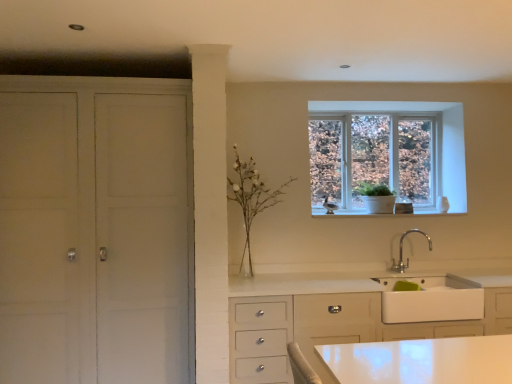
The image size is (512, 384). What do you see at coordinates (95, 230) in the screenshot? I see `white matte cabinet at left` at bounding box center [95, 230].

Looking at this image, what is the approximate height of chrome metallic faucet at lower right?

chrome metallic faucet at lower right is 13.73 inches in height.

The width and height of the screenshot is (512, 384). I want to click on white glass vase at center, so click(x=251, y=197).

Does white matte cabinet at left appear on the right side of clear glass window at upper center?

No.

Is point (96, 179) more distant than point (413, 199)?

No.

From a real-world perspective, is white matte cabinet at left below clear glass window at upper center?

Yes, from a real-world perspective, white matte cabinet at left is beneath clear glass window at upper center.

Looking at this image, is white matte sink at lower right oriented away from chrome metallic faucet at lower right?

No, white matte sink at lower right is not facing away from chrome metallic faucet at lower right.

Visually, is white matte sink at lower right positioned to the left or to the right of chrome metallic faucet at lower right?

white matte sink at lower right is positioned on chrome metallic faucet at lower right's right side.

In the scene shown: Does white matte sink at lower right have a lesser height compared to chrome metallic faucet at lower right?

Yes.

Based on the photo, can you confirm if white matte sink at lower right is wider than chrome metallic faucet at lower right?

Yes.

Is white matte cabinet at left completely or partially outside of chrome metallic faucet at lower right?

Yes, white matte cabinet at left is located beyond the bounds of chrome metallic faucet at lower right.

Which of these two, white matte cabinet at left or chrome metallic faucet at lower right, stands taller?

white matte cabinet at left is taller.

From the image's perspective, between white matte cabinet at left and chrome metallic faucet at lower right, which one is located above?

white matte cabinet at left appears higher in the image.

Considering the positions of objects white matte cabinet at left and chrome metallic faucet at lower right in the image provided, who is more to the right, white matte cabinet at left or chrome metallic faucet at lower right?

chrome metallic faucet at lower right is more to the right.

Can you confirm if clear glass window at upper center is taller than white matte sink at lower right?

Yes.

How different are the orientations of clear glass window at upper center and white matte sink at lower right in degrees?

The angular difference between clear glass window at upper center and white matte sink at lower right is 2.29 degrees.

Can you confirm if clear glass window at upper center is positioned to the right of white matte sink at lower right?

No.

From a real-world perspective, is chrome metallic faucet at lower right physically located above or below white matte cabinet at left?

chrome metallic faucet at lower right is situated lower than white matte cabinet at left in the real world.

Are chrome metallic faucet at lower right and white matte cabinet at left making contact?

chrome metallic faucet at lower right is not next to white matte cabinet at left, and they're not touching.

Looking at this image, which is closer to the camera, (403, 270) or (7, 369)?

Positioned in front is point (7, 369).

Which object is wider, chrome metallic faucet at lower right or white matte cabinet at left?

With larger width is white matte cabinet at left.

How many degrees apart are the facing directions of white matte sink at lower right and clear glass window at upper center?

They differ by 2.29 degrees in their facing directions.

Is white matte sink at lower right positioned with its back to clear glass window at upper center?

white matte sink at lower right does not have its back to clear glass window at upper center.

This screenshot has height=384, width=512. What are the coordinates of `window behind the white matte sink at lower right` in the screenshot? It's located at pyautogui.click(x=387, y=154).

From a real-world perspective, who is located higher, white matte sink at lower right or clear glass window at upper center?

From a 3D spatial view, clear glass window at upper center is above.

Does white glass vase at center contain white matte sink at lower right?

No, white matte sink at lower right is not inside white glass vase at center.

At what (x,y) coordinates should I click in order to perform the action: click on sink on the right of white glass vase at center. Please return your answer as a coordinate pair (x, y). The width and height of the screenshot is (512, 384). Looking at the image, I should click on (431, 299).

From the image's perspective, is white glass vase at center above white matte sink at lower right?

Indeed, from the image's perspective, white glass vase at center is shown above white matte sink at lower right.

Considering the sizes of white glass vase at center and white matte sink at lower right in the image, is white glass vase at center wider or thinner than white matte sink at lower right?

Considering their sizes, white glass vase at center looks slimmer than white matte sink at lower right.

The image size is (512, 384). Find the location of `window above the white matte cabinet at left (from a real-world perspective)`. window above the white matte cabinet at left (from a real-world perspective) is located at coordinates (387, 154).

This screenshot has width=512, height=384. Identify the location of tap behind the white matte sink at lower right. (402, 251).

Looking at the image, which one is located closer to white glass vase at center, white matte cabinet at left or chrome metallic faucet at lower right?

white matte cabinet at left is closer to white glass vase at center.

Considering their positions, is white matte sink at lower right positioned further to chrome metallic faucet at lower right than clear glass window at upper center?

clear glass window at upper center.

Looking at the image, which one is located further to clear glass window at upper center, white glass vase at center or chrome metallic faucet at lower right?

Among the two, white glass vase at center is located further to clear glass window at upper center.

Considering their positions, is white matte sink at lower right positioned closer to white glass vase at center than chrome metallic faucet at lower right?

Among the two, chrome metallic faucet at lower right is located nearer to white glass vase at center.

Based on their spatial positions, is white glass vase at center or chrome metallic faucet at lower right closer to white matte sink at lower right?

chrome metallic faucet at lower right.

When comparing their distances from clear glass window at upper center, does chrome metallic faucet at lower right or white matte cabinet at left seem further?

white matte cabinet at left.

Consider the image. From the image, which object appears to be nearer to white matte cabinet at left, chrome metallic faucet at lower right or clear glass window at upper center?

The object closer to white matte cabinet at left is clear glass window at upper center.

Consider the image. Which object lies nearer to the anchor point white glass vase at center, clear glass window at upper center or white matte cabinet at left?

clear glass window at upper center is closer to white glass vase at center.

Identify the location of plant between white matte cabinet at left and chrome metallic faucet at lower right from left to right. (251, 197).

This screenshot has width=512, height=384. I want to click on window between white glass vase at center and chrome metallic faucet at lower right in the horizontal direction, so click(x=387, y=154).

Where is `window between white matte cabinet at left and chrome metallic faucet at lower right from left to right`? The width and height of the screenshot is (512, 384). window between white matte cabinet at left and chrome metallic faucet at lower right from left to right is located at coordinates (387, 154).

At what (x,y) coordinates should I click in order to perform the action: click on plant located between white matte cabinet at left and clear glass window at upper center in the left-right direction. Please return your answer as a coordinate pair (x, y). The height and width of the screenshot is (384, 512). Looking at the image, I should click on (251, 197).